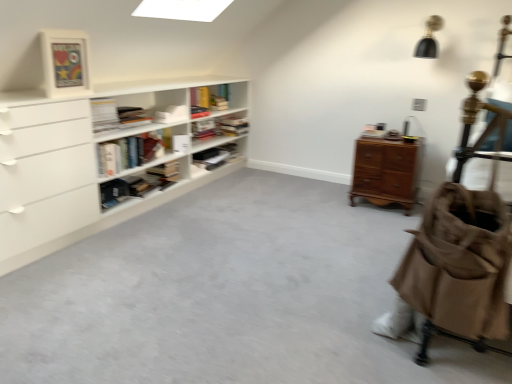
This screenshot has width=512, height=384. Find the location of `free space to the left of light brown wooden chest of drawers at right`. free space to the left of light brown wooden chest of drawers at right is located at coordinates (329, 198).